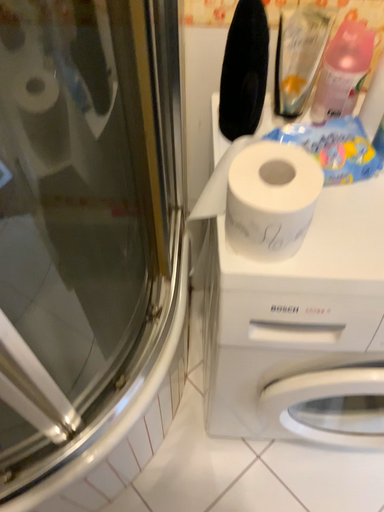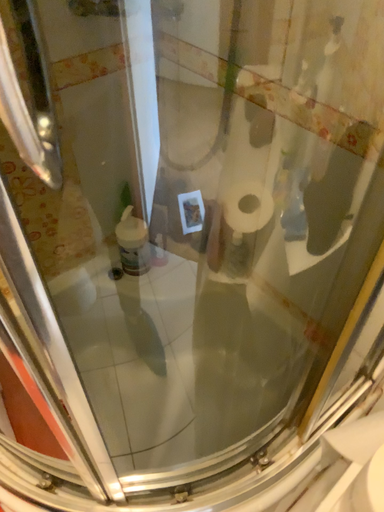
Question: Which way did the camera rotate in the video?

Choices:
 (A) rotated upward
 (B) rotated downward

Answer: (A)